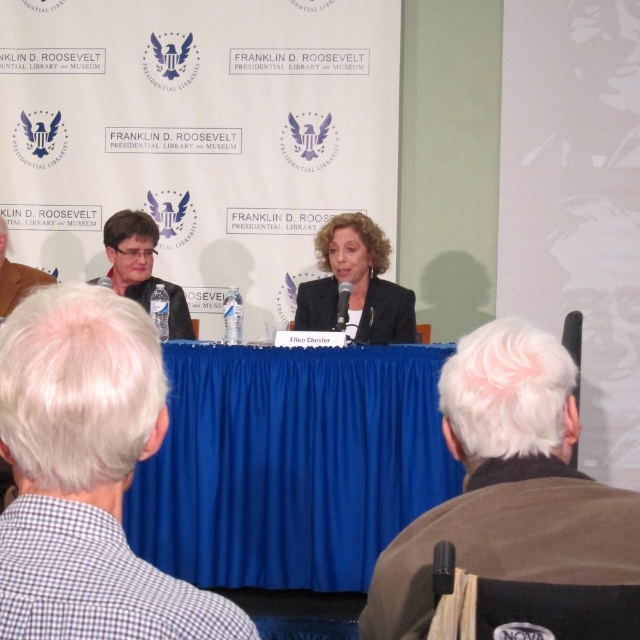
Can you confirm if blue fabric table at center is taller than matte black suit at center?

Indeed, blue fabric table at center has a greater height compared to matte black suit at center.

Can you confirm if blue fabric table at center is positioned below matte black suit at center?

Yes, blue fabric table at center is below matte black suit at center.

The image size is (640, 640). What do you see at coordinates (289, 464) in the screenshot? I see `blue fabric table at center` at bounding box center [289, 464].

The width and height of the screenshot is (640, 640). In order to click on blue fabric table at center in this screenshot , I will do `click(289, 464)`.

Who is taller, blue fabric table at center or brown wool jacket at lower right?

Standing taller between the two is blue fabric table at center.

Describe the element at coordinates (289, 464) in the screenshot. I see `blue fabric table at center` at that location.

Which is in front, point (230, 420) or point (634, 506)?

Point (634, 506)

The height and width of the screenshot is (640, 640). I want to click on blue fabric table at center, so click(x=289, y=464).

Who is lower down, blue fabric table at center or checkered fabric shirt at lower left?

blue fabric table at center is lower down.

Which is in front, point (349, 392) or point (24, 333)?

Point (24, 333)

Find the location of `blue fabric table at center`. blue fabric table at center is located at coordinates (289, 464).